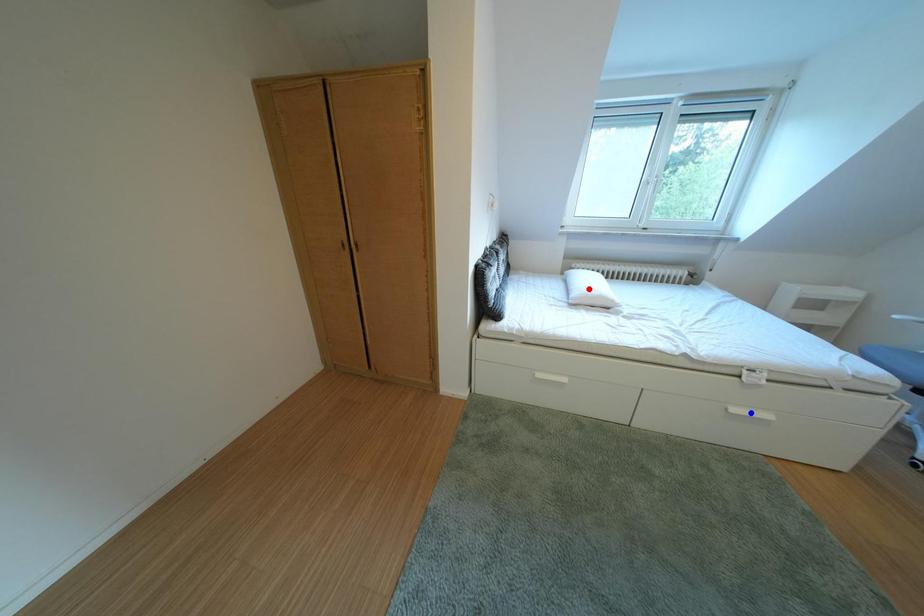
Question: Two points are marked on the image. Which point is closer to the camera?

Choices:
 (A) Blue point is closer.
 (B) Red point is closer.

Answer: (A)